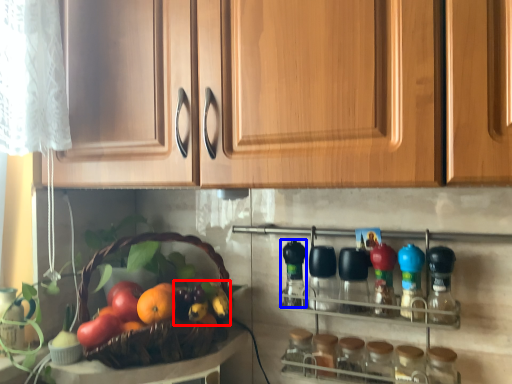
Question: Which point is further to the camera, fruit (highlighted by a red box) or bottle (highlighted by a blue box)?

Choices:
 (A) fruit
 (B) bottle

Answer: (B)